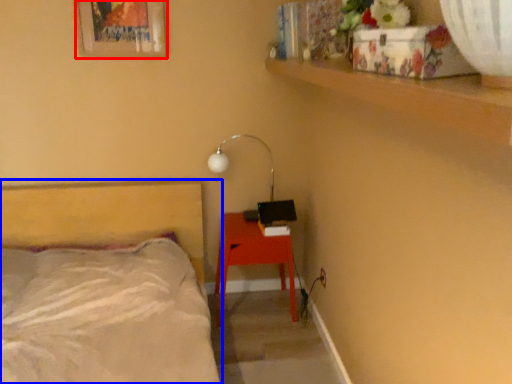
Question: Which of the following is the farthest to the observer, picture frame (highlighted by a red box) or bed (highlighted by a blue box)?

Choices:
 (A) picture frame
 (B) bed

Answer: (A)